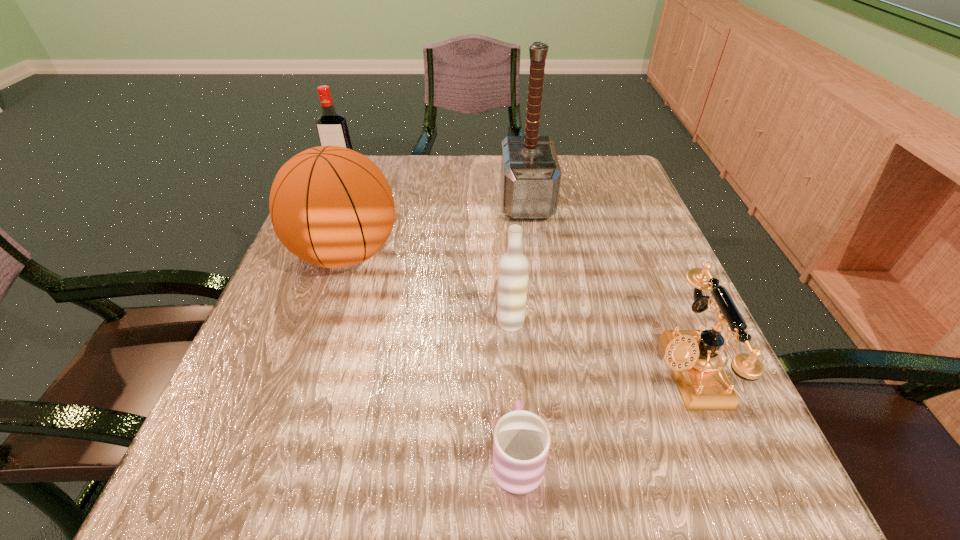
Locate an element on the screen. The width and height of the screenshot is (960, 540). vodka positioned at the left edge is located at coordinates (332, 128).

The height and width of the screenshot is (540, 960). I want to click on basketball present at the left edge, so click(x=331, y=206).

This screenshot has height=540, width=960. Find the location of `object that is at the right edge`. object that is at the right edge is located at coordinates (693, 355).

In order to click on object at the far left corner in this screenshot , I will do `click(332, 128)`.

Where is `vacant space at the far edge of the desktop`? vacant space at the far edge of the desktop is located at coordinates (452, 187).

In the image, there is a desktop. What are the coordinates of `free space at the near edge` in the screenshot? It's located at (523, 507).

This screenshot has width=960, height=540. I want to click on free space at the left edge of the desktop, so click(x=273, y=295).

What are the coordinates of `vacant region at the right edge of the desktop` in the screenshot? It's located at (665, 246).

Locate an element on the screen. This screenshot has height=540, width=960. free space at the far right corner is located at coordinates point(615,184).

In the image, there is a desktop. Find the location of `vacant space at the near right corner`. vacant space at the near right corner is located at coordinates (669, 483).